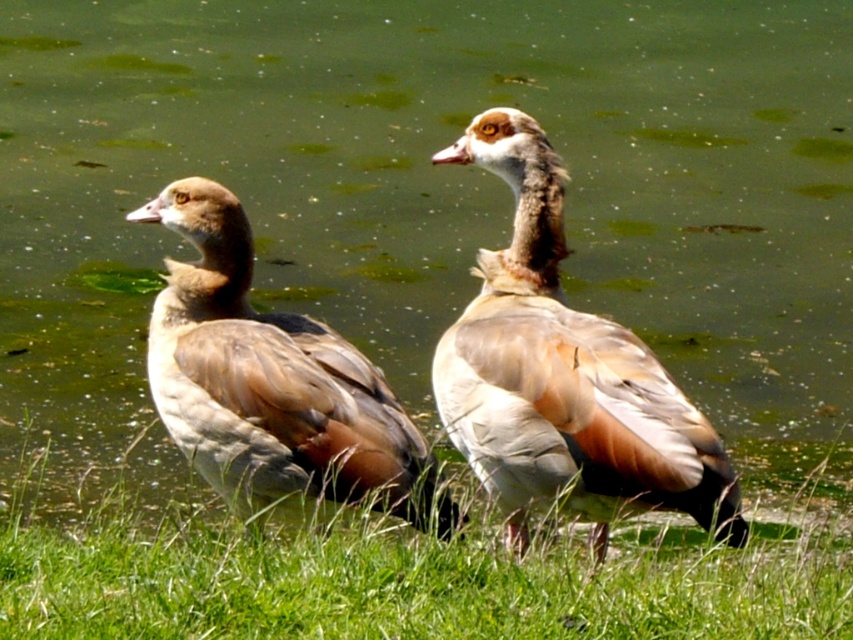
Question: Does brown feathered duck at center come behind brown feathered duck at left?

Choices:
 (A) yes
 (B) no

Answer: (B)

Question: Does brown feathered duck at center have a lesser width compared to brown feathered duck at left?

Choices:
 (A) yes
 (B) no

Answer: (A)

Question: Is the position of green grass at lower center less distant than that of brown feathered duck at center?

Choices:
 (A) yes
 (B) no

Answer: (A)

Question: Which point is closer to the camera?

Choices:
 (A) (415, 557)
 (B) (238, 275)
 (C) (514, 428)

Answer: (A)

Question: Among these objects, which one is nearest to the camera?

Choices:
 (A) brown feathered duck at center
 (B) brown feathered duck at left
 (C) green grass at lower center

Answer: (C)

Question: Among these points, which one is nearest to the camera?

Choices:
 (A) (170, 321)
 (B) (311, 605)
 (C) (619, 376)

Answer: (B)